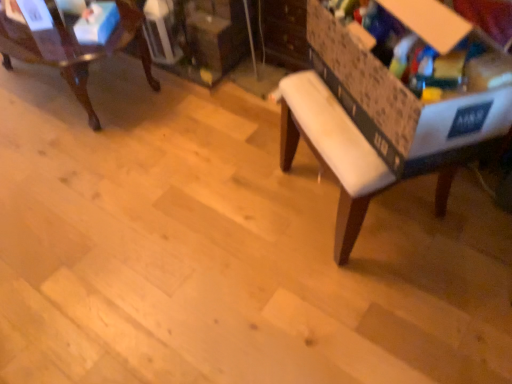
You are a GUI agent. You are given a task and a screenshot of the screen. Output one action in this format:
    pyautogui.click(x=<x>, y=<y>)
    Task: Click on the free spot in front of white fabric bench at center
    The image size is (512, 384).
    Given the screenshot: What is the action you would take?
    pyautogui.click(x=396, y=324)